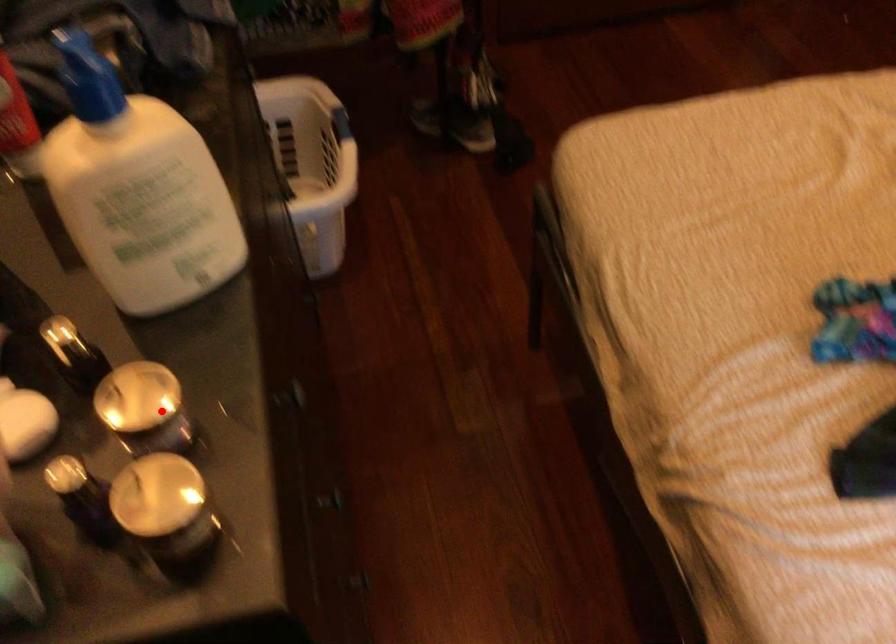
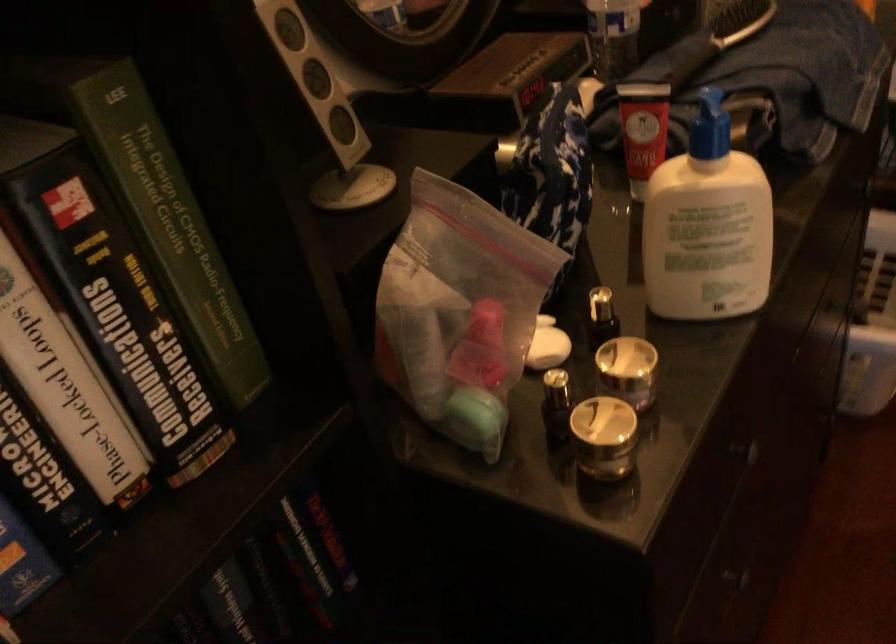
Question: I am providing you with two images of the same scene from different viewpoints. Given a red point in image1, look at the same physical point in image2. Is it:

Choices:
 (A) Closer to the viewpoint
 (B) Farther from the viewpoint

Answer: (B)